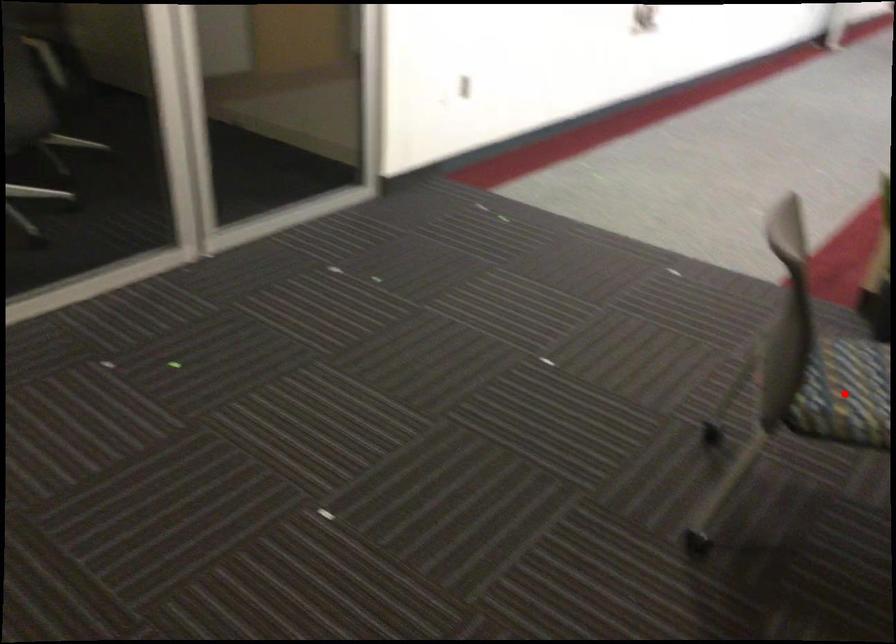
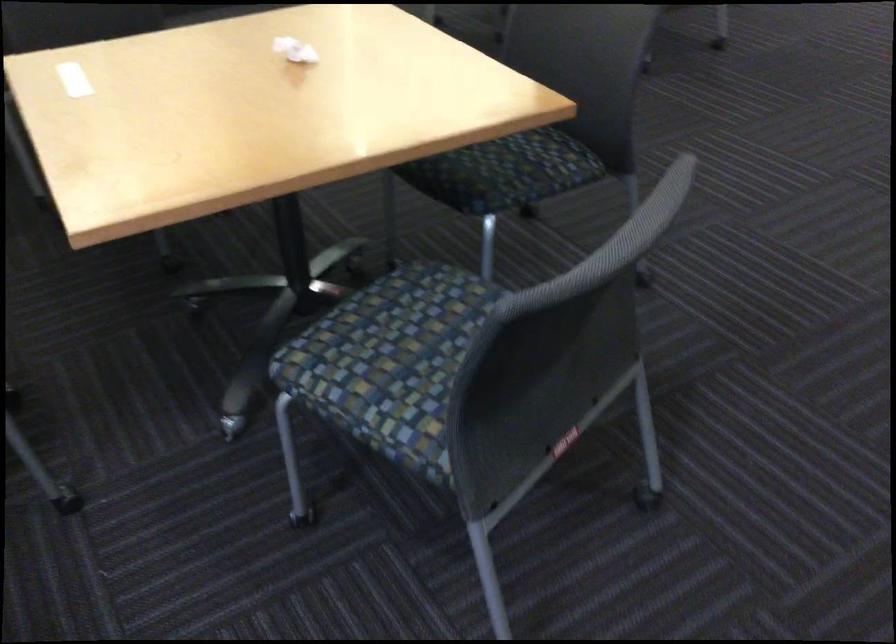
Question: I am providing you with two images of the same scene from different viewpoints. A red point is marked on the first image. At the location where the point appears in image 1, is it still visible in image 2?

Choices:
 (A) Yes
 (B) No

Answer: (B)